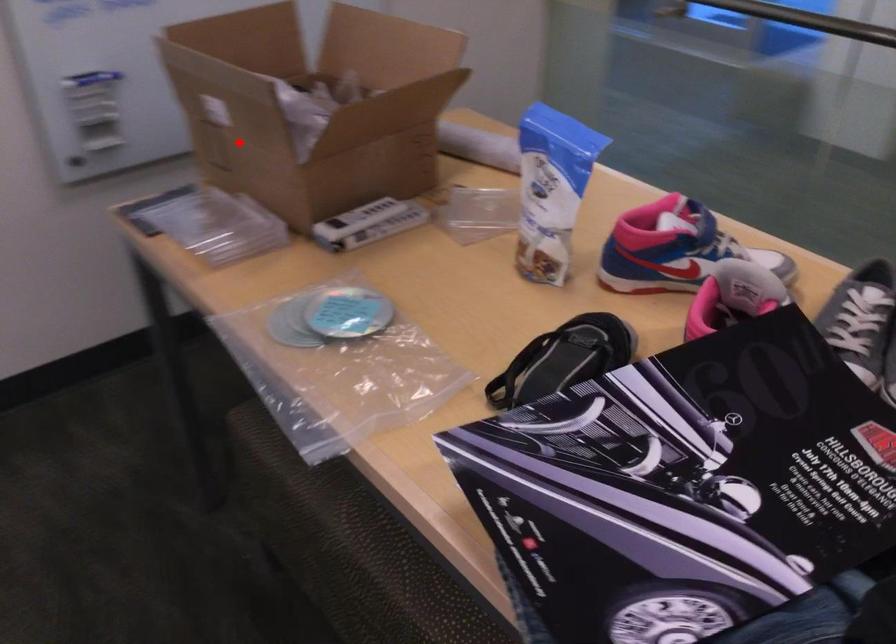
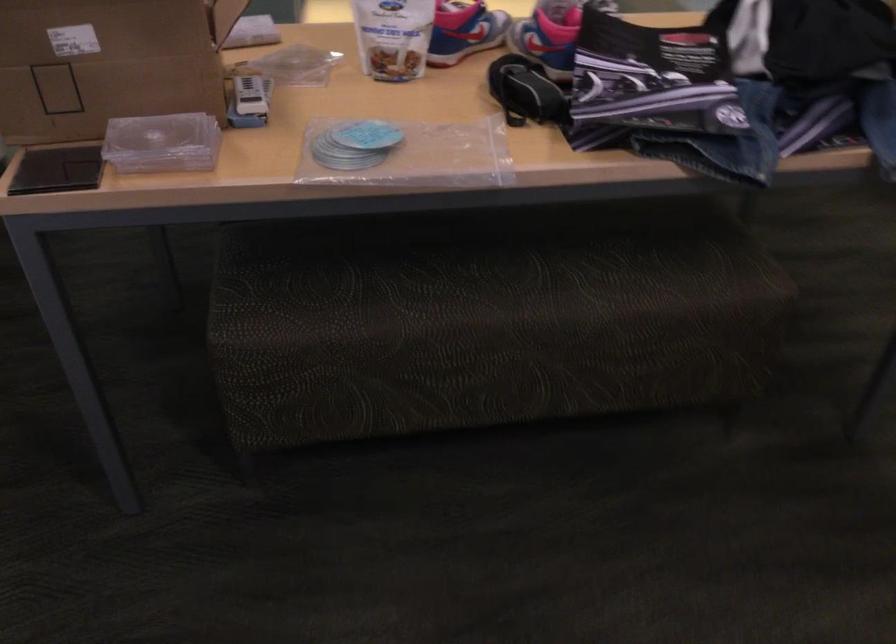
Find the pixel in the second image that matches the highlighted location in the first image.

(107, 62)